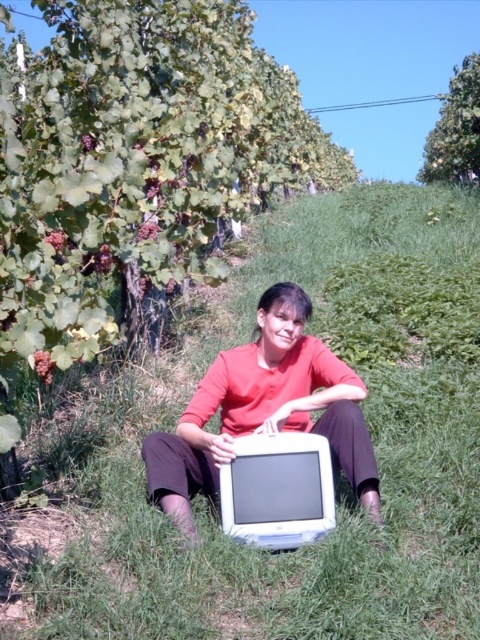
Can you confirm if green grassy at center is thinner than matte white monitor at center?

No, green grassy at center is not thinner than matte white monitor at center.

Is point (446, 609) farther from camera compared to point (328, 404)?

No, it is not.

Locate an element on the screen. This screenshot has height=640, width=480. green grassy at center is located at coordinates (340, 483).